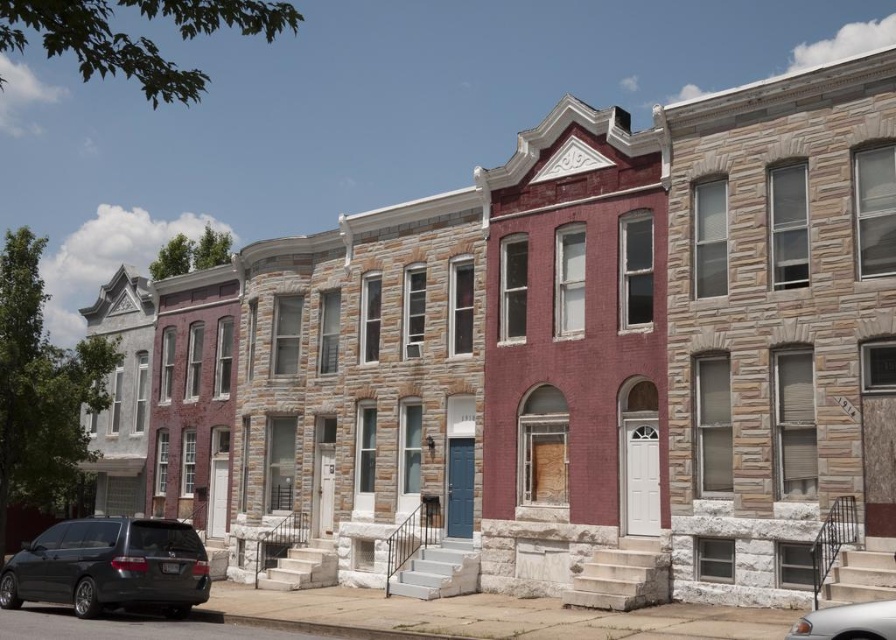
Question: Is matte black minivan at lower left to the right of silver metallic car at lower right from the viewer's perspective?

Choices:
 (A) yes
 (B) no

Answer: (B)

Question: Does matte black minivan at lower left have a lesser width compared to silver metallic car at lower right?

Choices:
 (A) no
 (B) yes

Answer: (A)

Question: Which point is closer to the camera taking this photo?

Choices:
 (A) (82, 596)
 (B) (834, 609)

Answer: (B)

Question: Which of the following is the farthest from the observer?

Choices:
 (A) silver metallic car at lower right
 (B) matte black minivan at lower left

Answer: (B)

Question: Which point is farther from the camera taking this photo?

Choices:
 (A) [820, 618]
 (B) [162, 541]

Answer: (B)

Question: Is matte black minivan at lower left positioned before silver metallic car at lower right?

Choices:
 (A) no
 (B) yes

Answer: (A)